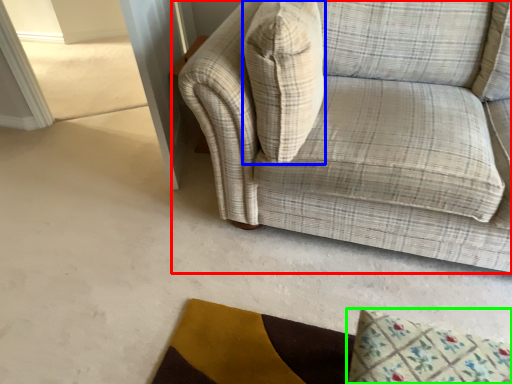
Question: Considering the real-world distances, which object is farthest from studio couch (highlighted by a red box)? throw pillow (highlighted by a blue box) or mat (highlighted by a green box)?

Choices:
 (A) throw pillow
 (B) mat

Answer: (B)